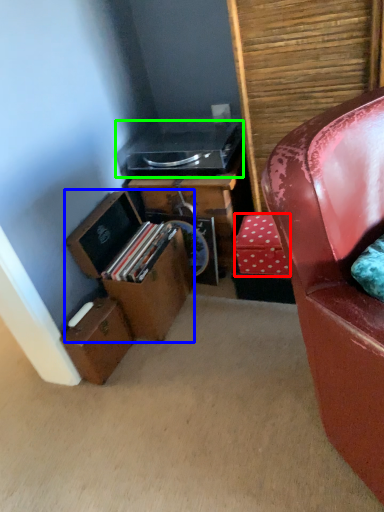
Question: Considering the real-world distances, which object is farthest from cardboard box (highlighted by a red box)? box (highlighted by a blue box) or stereo (highlighted by a green box)?

Choices:
 (A) box
 (B) stereo

Answer: (B)